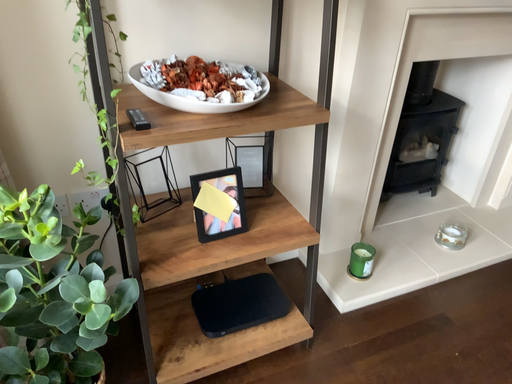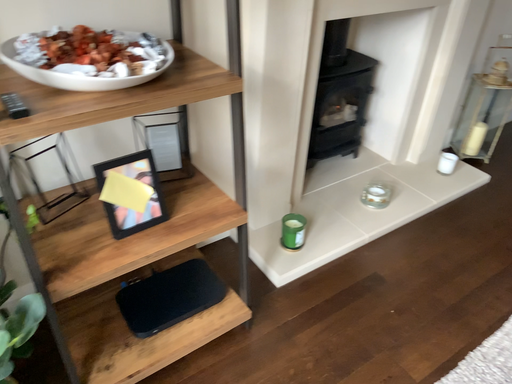
Question: Which way did the camera rotate in the video?

Choices:
 (A) rotated right
 (B) rotated left

Answer: (A)